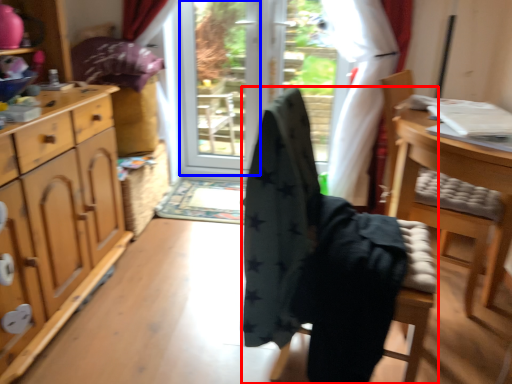
Question: Among these objects, which one is nearest to the camera, chair (highlighted by a red box) or screen door (highlighted by a blue box)?

Choices:
 (A) chair
 (B) screen door

Answer: (A)